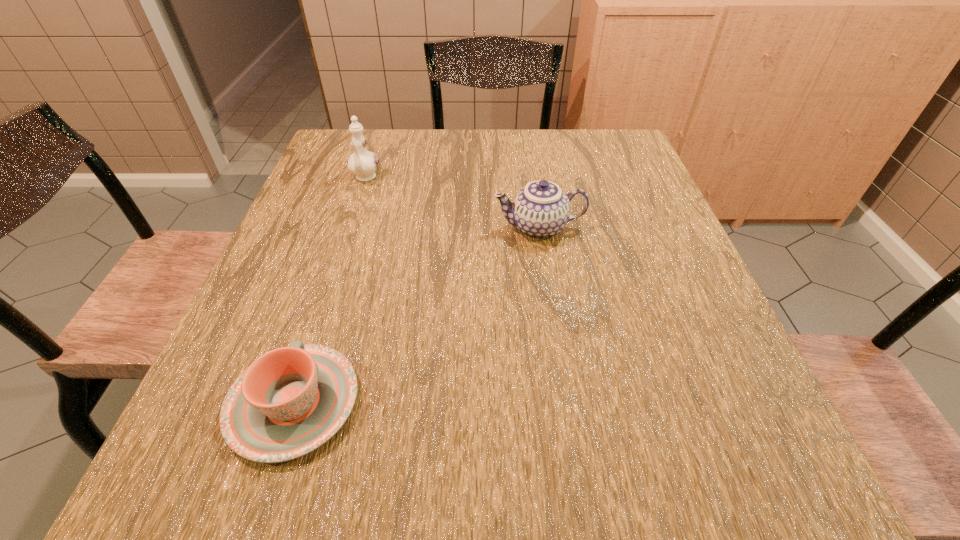
Where is `vacant point located on the handle side of the shortest chinaware`? This screenshot has height=540, width=960. vacant point located on the handle side of the shortest chinaware is located at coordinates (335, 276).

This screenshot has width=960, height=540. Identify the location of vacant region located 0.360m on the handle side of the shortest chinaware. (353, 221).

Find the location of a particular element. This screenshot has width=960, height=540. vacant space located 0.080m on the handle side of the shortest chinaware is located at coordinates (323, 315).

The height and width of the screenshot is (540, 960). Find the location of `object that is at the far edge`. object that is at the far edge is located at coordinates (363, 163).

Where is `object that is positioned at the near edge`? The width and height of the screenshot is (960, 540). object that is positioned at the near edge is located at coordinates (290, 401).

This screenshot has width=960, height=540. In order to click on object present at the far left corner in this screenshot , I will do `click(363, 163)`.

Find the location of a particular element. The image size is (960, 540). object that is positioned at the near left corner is located at coordinates coord(290,401).

The height and width of the screenshot is (540, 960). In order to click on blank space at the far edge of the desktop in this screenshot , I will do [x=441, y=143].

Find the location of `vacant region at the left edge`. vacant region at the left edge is located at coordinates (355, 201).

Locate an element on the screen. Image resolution: width=960 pixels, height=540 pixels. free space at the right edge of the desktop is located at coordinates (653, 206).